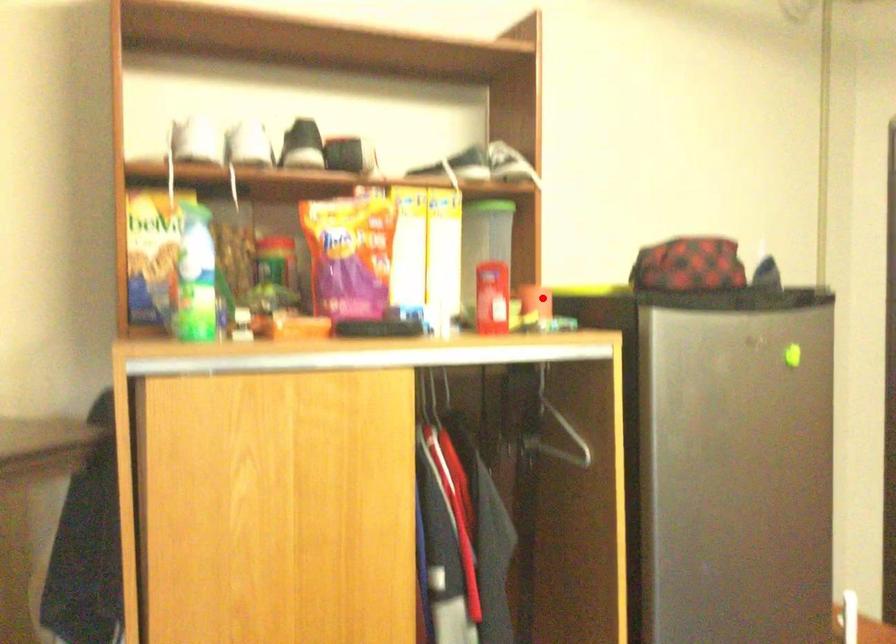
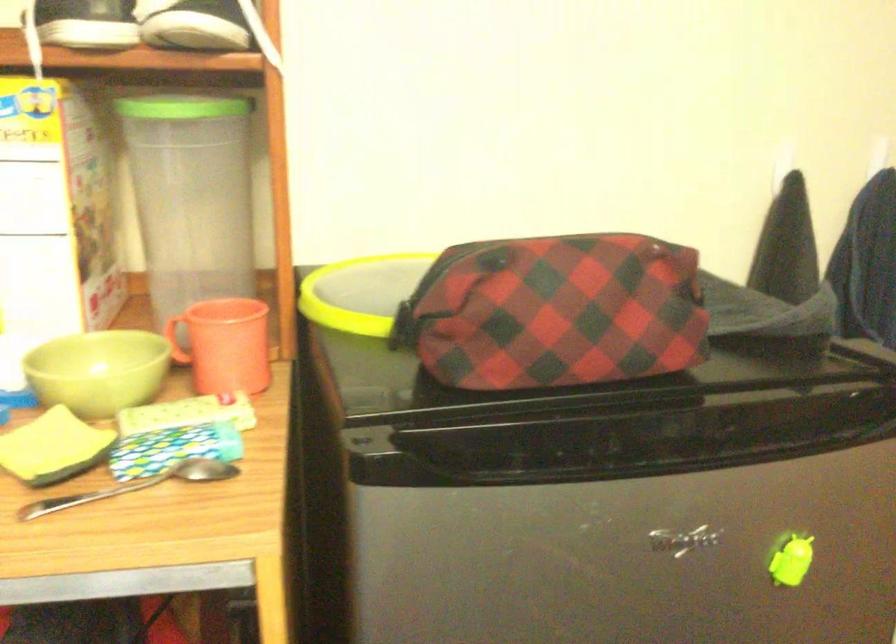
The point at the highlighted location is marked in the first image. Where is the corresponding point in the second image?

(224, 345)